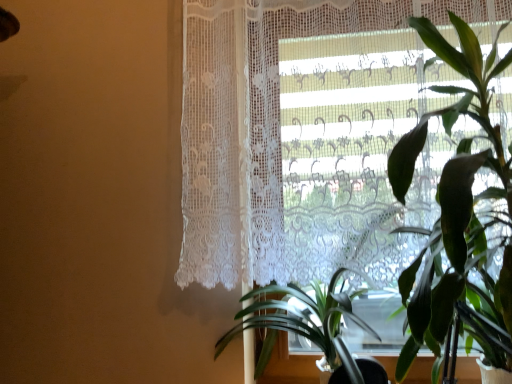
Question: Considering the positions of green leafy plant at center, the first houseplant positioned from the left, and green leafy plant at right, the second houseplant positioned from the left, in the image, is green leafy plant at center, the first houseplant positioned from the left, wider or thinner than green leafy plant at right, the second houseplant positioned from the left,?

Choices:
 (A) wide
 (B) thin

Answer: (A)

Question: From the image's perspective, is green leafy plant at center, the first houseplant positioned from the left, above or below green leafy plant at right, the first houseplant in the right-to-left sequence?

Choices:
 (A) below
 (B) above

Answer: (A)

Question: Which object is positioned farthest from the green leafy plant at center, the first houseplant positioned from the left?

Choices:
 (A) white lace curtain at upper right
 (B) green leafy plant at right, the second houseplant positioned from the left

Answer: (A)

Question: Estimate the real-world distances between objects in this image. Which object is farther from the white lace curtain at upper right?

Choices:
 (A) green leafy plant at center, the first houseplant positioned from the left
 (B) green leafy plant at right, the second houseplant positioned from the left

Answer: (A)